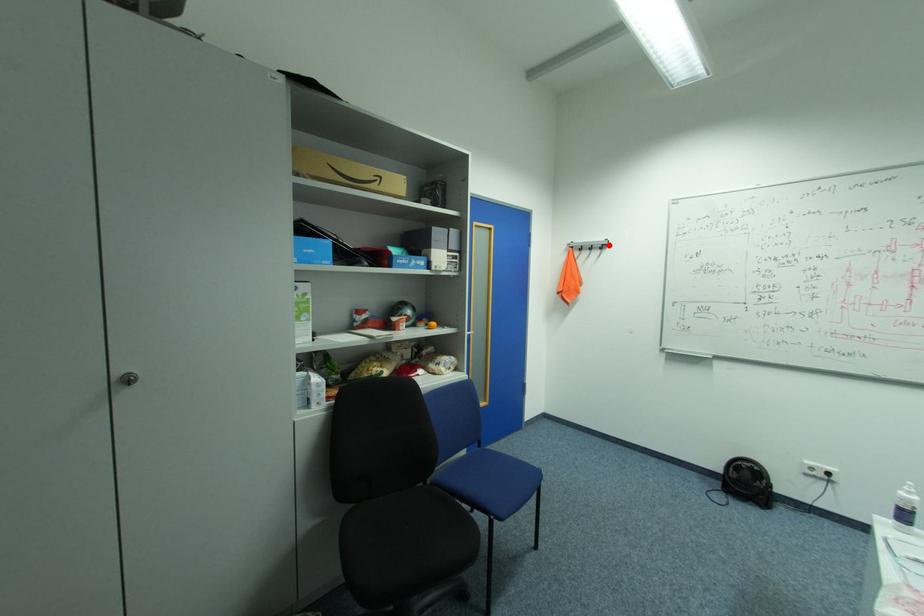
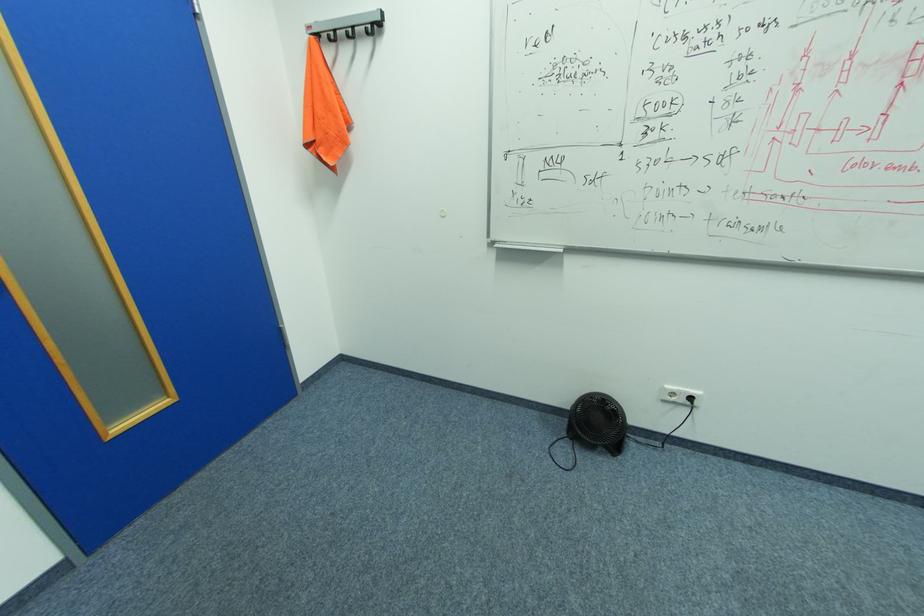
Question: I am providing you with two images of the same scene from different viewpoints. A red point is marked on the first image. Is the red point's position out of view in image 2?

Choices:
 (A) Yes
 (B) No

Answer: (B)